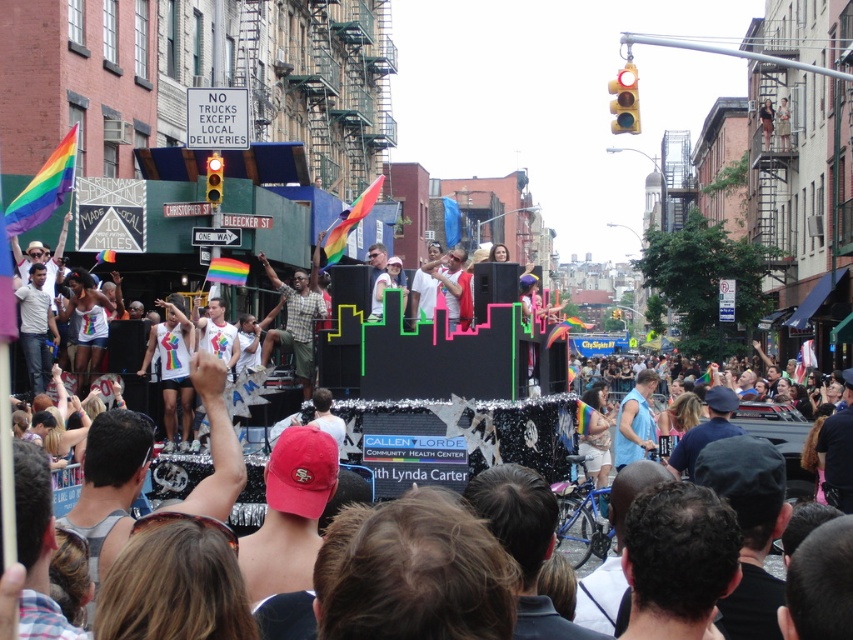
You are a photographer trying to capture both the checkered fabric shirt at center and the neon plastic float at center in the same frame. Which object should you focus on first to ensure both are in the shot?

The checkered fabric shirt at center is thinner than the neon plastic float at center, so you should focus on the neon plastic float at center first to ensure both are in the shot.

You are a photographer at the Pride parade. You want to take a photo of both the checkered fabric shirt at center and the neon plastic float at center. Which object should you focus on first if you want to capture them in the correct left to right order?

The checkered fabric shirt at center is to the left of the neon plastic float at center, so you should focus on the checkered fabric shirt at center first to maintain the left to right order.

You are a participant in the Pride parade and you want to see the neon plastic float at center. However, there is a person wearing a checkered fabric shirt at center blocking your view. Can you see the float through the shirt?

The neon plastic float at center is behind the checkered fabric shirt at center, so you cannot see the float through the shirt.